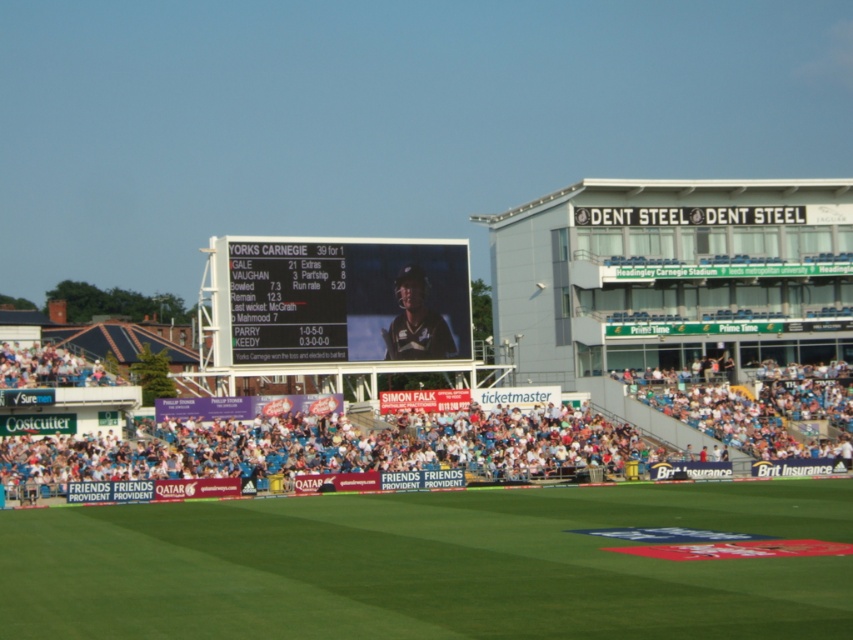
Describe the element at coordinates (426, 564) in the screenshot. I see `green grass at center` at that location.

Between green grass at center and white fabric crowd at lower center, which one appears on the left side from the viewer's perspective?

green grass at center

Describe the element at coordinates (426, 564) in the screenshot. The image size is (853, 640). I see `green grass at center` at that location.

Image resolution: width=853 pixels, height=640 pixels. What are the coordinates of `green grass at center` in the screenshot? It's located at (426, 564).

Between green grass at center and black plastic scoreboard at center, which one appears on the left side from the viewer's perspective?

black plastic scoreboard at center

Does point (210, 596) come closer to viewer compared to point (288, 262)?

Yes, point (210, 596) is closer to viewer.

Is point (561, 602) positioned before point (442, 260)?

That is True.

Where is `green grass at center`? This screenshot has width=853, height=640. green grass at center is located at coordinates (426, 564).

Can you confirm if white fabric crowd at lower center is thinner than black plastic scoreboard at center?

In fact, white fabric crowd at lower center might be wider than black plastic scoreboard at center.

From the picture: Can you confirm if white fabric crowd at lower center is smaller than black plastic scoreboard at center?

Incorrect, white fabric crowd at lower center is not smaller in size than black plastic scoreboard at center.

Is point (585, 419) farther from viewer compared to point (432, 285)?

That is False.

Identify the location of white fabric crowd at lower center. This screenshot has height=640, width=853. (334, 448).